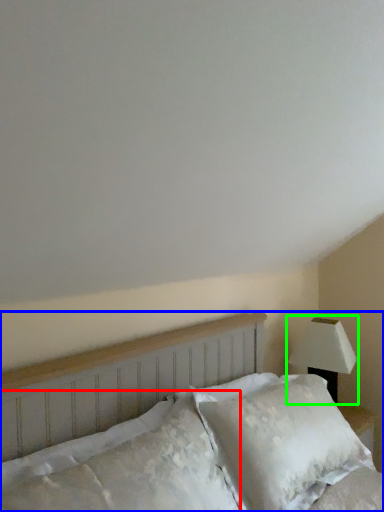
Question: Which is farther away from pillow (highlighted by a red box)? bed (highlighted by a blue box) or lamp (highlighted by a green box)?

Choices:
 (A) bed
 (B) lamp

Answer: (B)